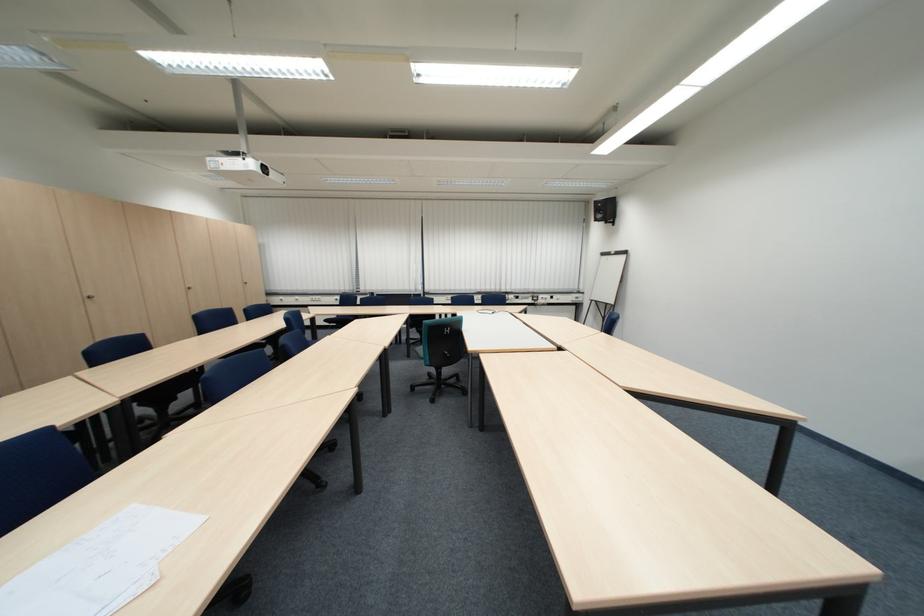
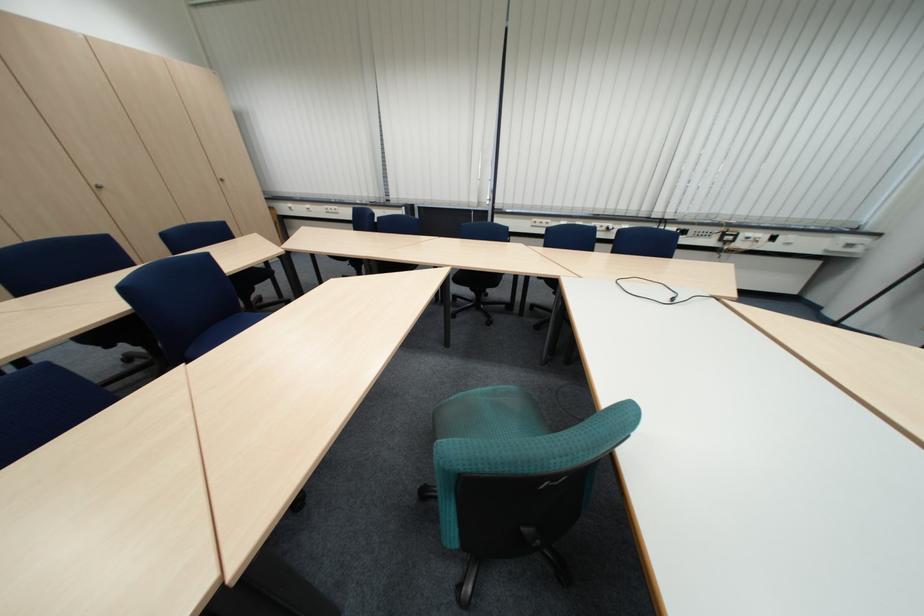
Question: Which direction would the cameraman need to move to produce the second image? Reply with the corresponding letter.

Choices:
 (A) Left
 (B) Right
 (C) Forward
 (D) Backward

Answer: (C)